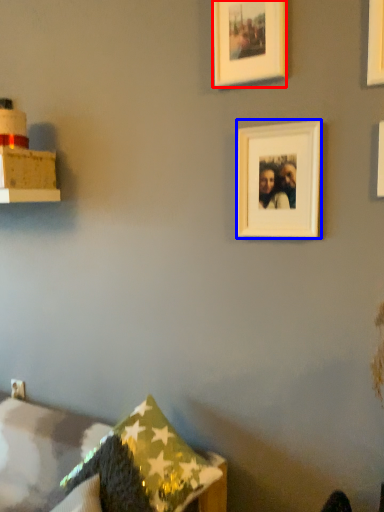
Question: Which point is further to the camera, picture frame (highlighted by a red box) or picture frame (highlighted by a blue box)?

Choices:
 (A) picture frame
 (B) picture frame

Answer: (A)